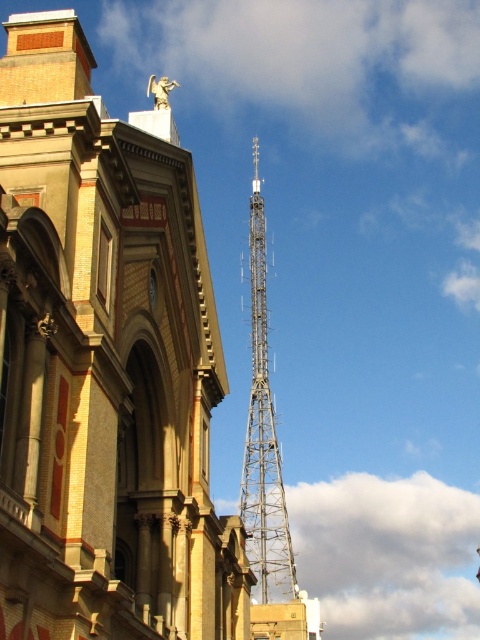
Who is more distant from viewer, (63, 154) or (287, 556)?

The point (287, 556) is behind.

Measure the distance between metallic lattice tower at right and camera.

The distance of metallic lattice tower at right from camera is 28.18 meters.

Identify the location of metallic lattice tower at right. The width and height of the screenshot is (480, 640). (105, 365).